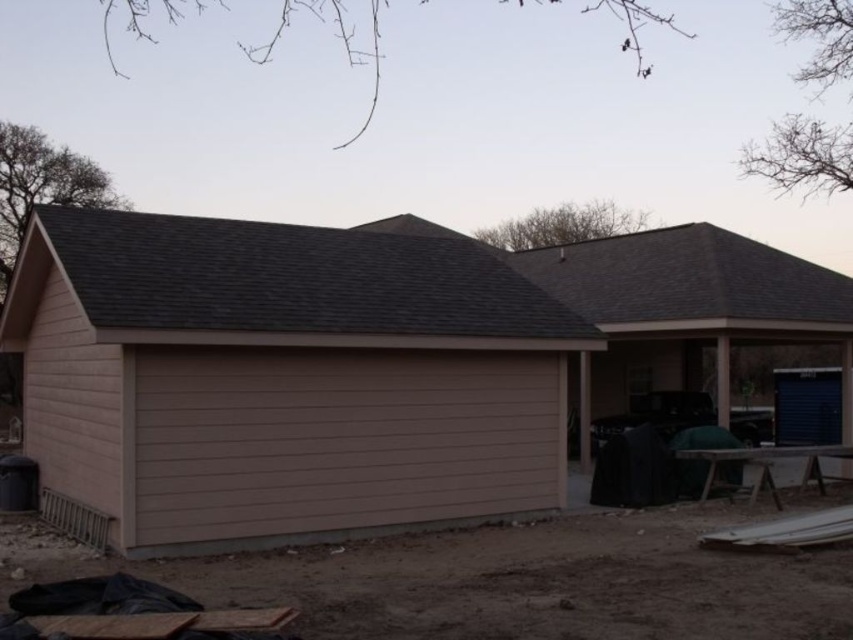
You are standing in front of the residential building and need to locate the beige siding garage at center. According to the coordinates provided, where exactly would you find it?

The beige siding garage at center is located at point (x=354, y=364).

You are a construction worker needing to transport materials from the dirt ground in front of the beige siding garage at center to the gray shingles at upper center. Which object is wider so you can determine the best path for your equipment?

The beige siding garage at center is wider than the gray shingles at upper center, so the best path would be near the beige siding garage at center to accommodate the equipment width.

You are a construction worker standing at the point marked by point (354,364). Looking around, you see beige siding garage at center. What is directly in front of you?

The point (354,364) indicates beige siding garage at center, so directly in front of you is the beige siding garage at center.